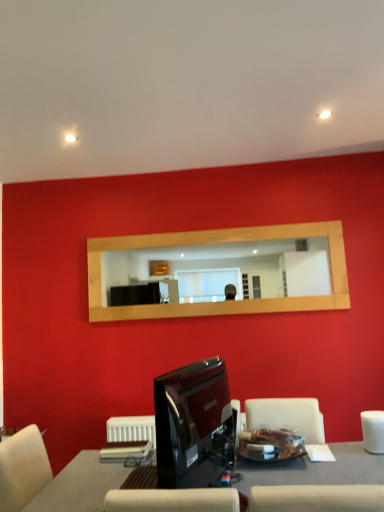
Question: Should I look upward or downward to see wooden mirror at center?

Choices:
 (A) down
 (B) up

Answer: (A)

Question: Is white matte armchair at lower right positioned before smooth gray table at center?

Choices:
 (A) yes
 (B) no

Answer: (B)

Question: Does white matte armchair at lower right have a lesser width compared to smooth gray table at center?

Choices:
 (A) yes
 (B) no

Answer: (A)

Question: Is white matte armchair at lower right turned away from smooth gray table at center?

Choices:
 (A) yes
 (B) no

Answer: (A)

Question: Does white matte armchair at lower right have a greater height compared to smooth gray table at center?

Choices:
 (A) no
 (B) yes

Answer: (A)

Question: From a real-world perspective, is white matte armchair at lower right on top of smooth gray table at center?

Choices:
 (A) no
 (B) yes

Answer: (B)

Question: From the image's perspective, is white matte armchair at lower right located above smooth gray table at center?

Choices:
 (A) no
 (B) yes

Answer: (B)

Question: Is wooden mirror at center smaller than smooth gray table at center?

Choices:
 (A) yes
 (B) no

Answer: (A)

Question: Can you confirm if wooden mirror at center is thinner than smooth gray table at center?

Choices:
 (A) yes
 (B) no

Answer: (A)

Question: Is wooden mirror at center not close to smooth gray table at center?

Choices:
 (A) no
 (B) yes

Answer: (B)

Question: From the image's perspective, is wooden mirror at center beneath smooth gray table at center?

Choices:
 (A) yes
 (B) no

Answer: (B)

Question: Can you confirm if wooden mirror at center is taller than smooth gray table at center?

Choices:
 (A) yes
 (B) no

Answer: (A)

Question: Can you confirm if wooden mirror at center is wider than smooth gray table at center?

Choices:
 (A) no
 (B) yes

Answer: (A)

Question: Does wooden mirror at center appear on the left side of white matte armchair at lower right?

Choices:
 (A) no
 (B) yes

Answer: (B)